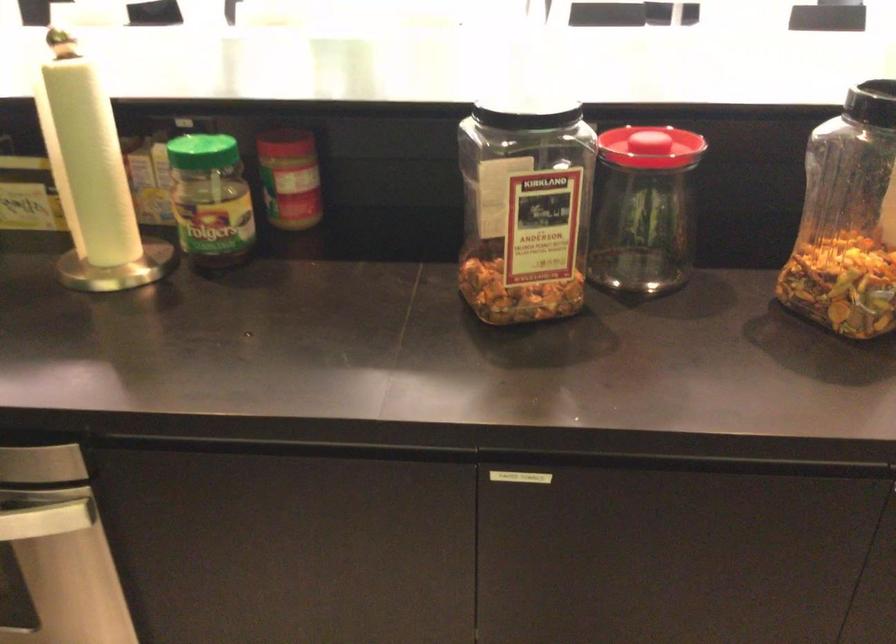
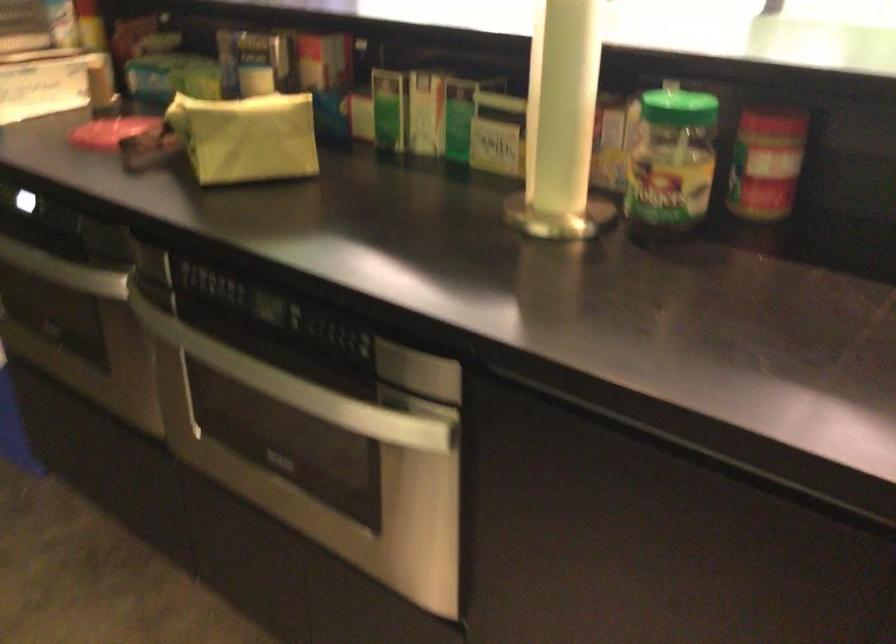
Question: The camera is either moving clockwise (left) or counter-clockwise (right) around the object. The first image is from the beginning of the video and the second image is from the end. Is the camera moving left or right when shooting the video?

Choices:
 (A) Left
 (B) Right

Answer: (B)